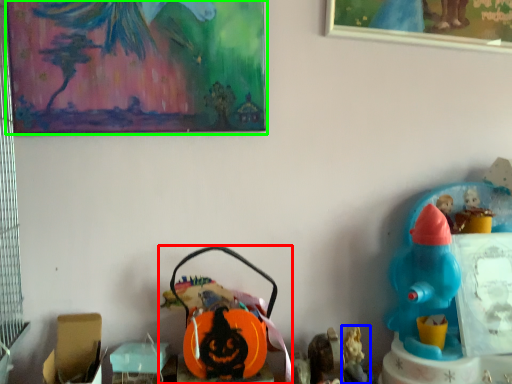
Question: Which object is positioned farthest from toy (highlighted by a red box)? Select from toy (highlighted by a blue box) and picture frame (highlighted by a green box).

Choices:
 (A) toy
 (B) picture frame

Answer: (B)